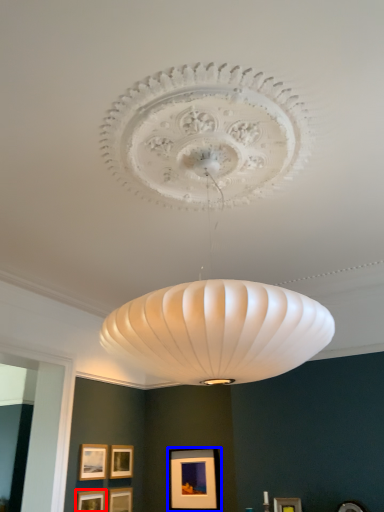
Question: Which point is further to the camera, picture frame (highlighted by a red box) or picture frame (highlighted by a blue box)?

Choices:
 (A) picture frame
 (B) picture frame

Answer: (B)